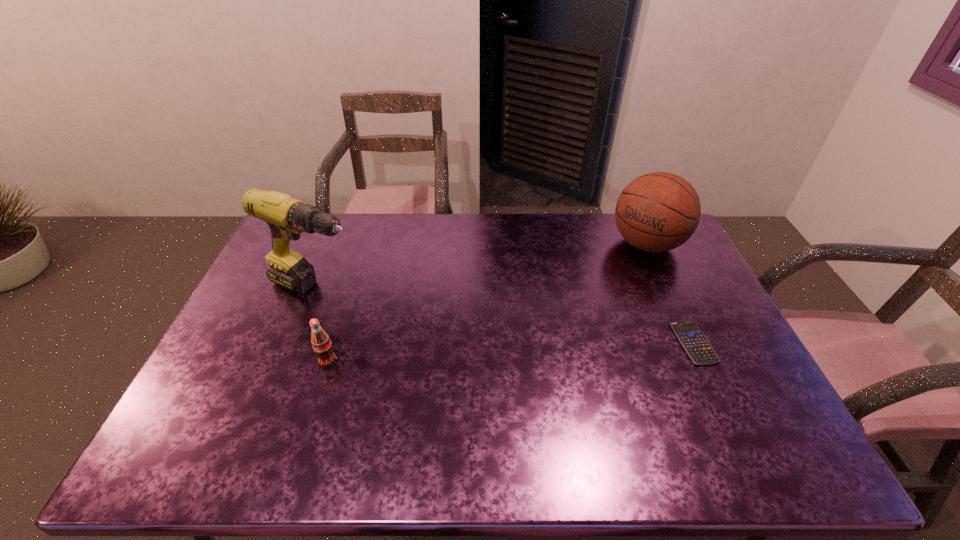
At what (x,y) coordinates should I click in order to perform the action: click on free space on the desktop that is between the second shortest object and the calculator and is positioned on the handle side of the drill. Please return your answer as a coordinate pair (x, y). The width and height of the screenshot is (960, 540). Looking at the image, I should click on (482, 354).

The width and height of the screenshot is (960, 540). What are the coordinates of `vacant space on the desktop that is between the soda and the shortest object and is positioned on the side with brand label of the second tallest object` in the screenshot? It's located at (544, 350).